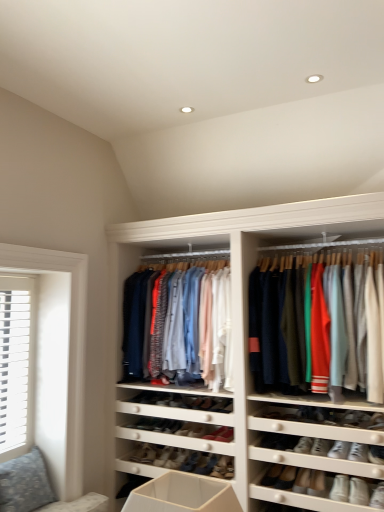
Question: Does point (23, 309) appear closer or farther from the camera than point (175, 352)?

Choices:
 (A) closer
 (B) farther

Answer: (A)

Question: Considering their positions, is white slatted wood at left located in front of or behind matte cotton shirts at center, marked as the 2th clothing in a right-to-left arrangement?

Choices:
 (A) behind
 (B) front

Answer: (B)

Question: Which of these objects is positioned farthest from the patterned fabric couch at lower left?

Choices:
 (A) matte cotton shirts at center, arranged as the 2th clothing when viewed from the left
 (B) shiny black shoe at center, placed as the 2th shoe when sorted from right to left
 (C) matte cotton shirts at center, which ranks as the 1th clothing in left-to-right order
 (D) white slatted wood at left
 (E) leather sneaker at center, the 1th shoe when ordered from bottom to top

Answer: (A)

Question: Which object is positioned closest to the leather sneaker at center, marked as the 1th shoe in a right-to-left arrangement?

Choices:
 (A) shiny black shoe at center, which appears as the second shoe when ordered from the bottom
 (B) matte cotton shirts at center, marked as the 2th clothing in a right-to-left arrangement
 (C) patterned fabric couch at lower left
 (D) matte cotton shirts at center, acting as the 1th clothing starting from the right
 (E) white slatted wood at left

Answer: (A)